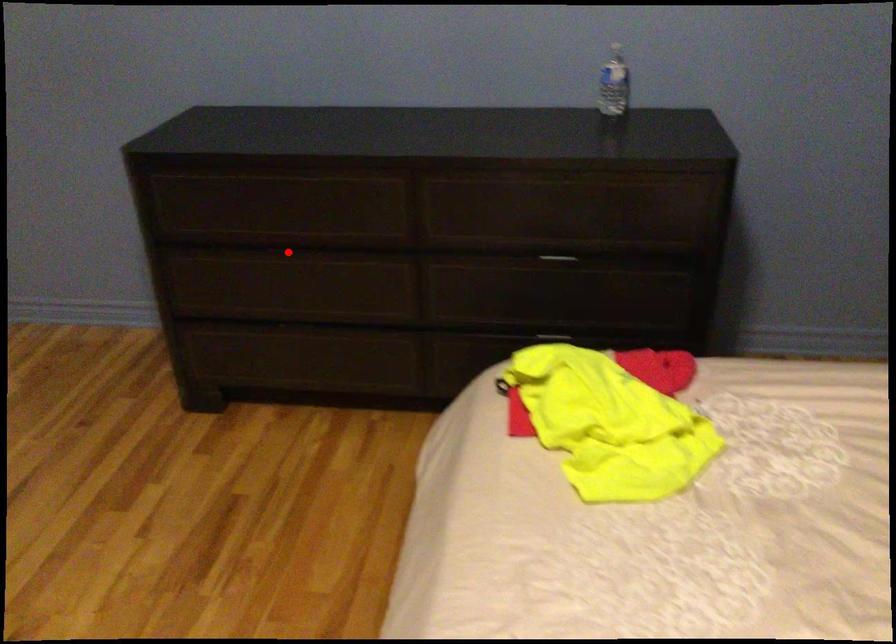
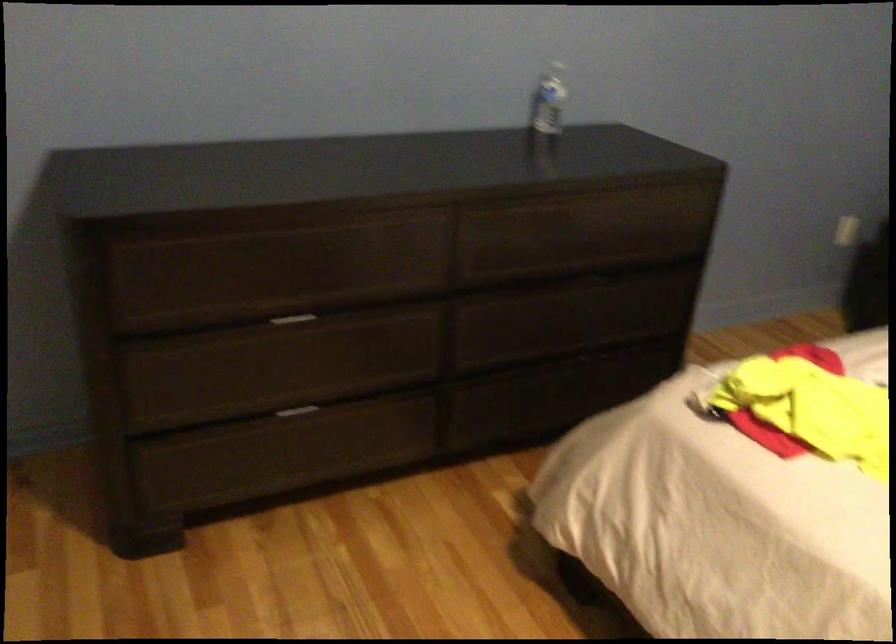
Question: I am providing you with two images of the same scene from different viewpoints. A red point is marked on the first image. Is the red point's position out of view in image 2?

Choices:
 (A) Yes
 (B) No

Answer: (B)